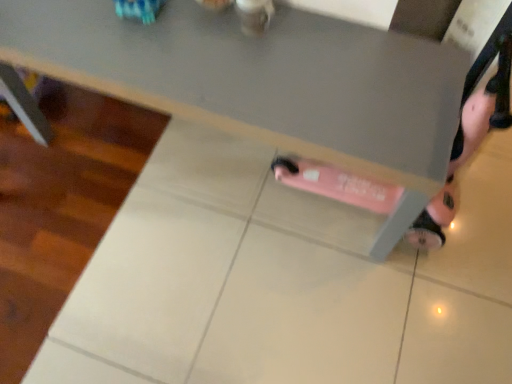
Where is `empty space that is ontop of matte gray table at center (from a real-world perspective)`? empty space that is ontop of matte gray table at center (from a real-world perspective) is located at coordinates (224, 56).